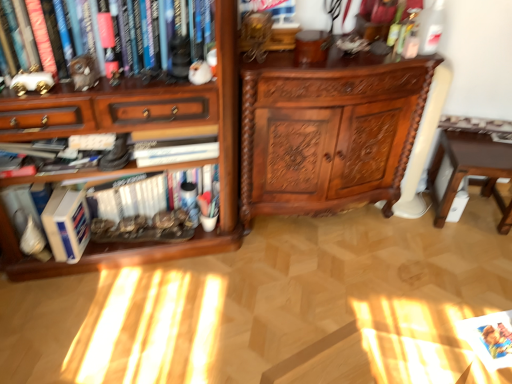
Where is `vacant area that lies to the right of polished wood cabinet at center`? Image resolution: width=512 pixels, height=384 pixels. vacant area that lies to the right of polished wood cabinet at center is located at coordinates (434, 254).